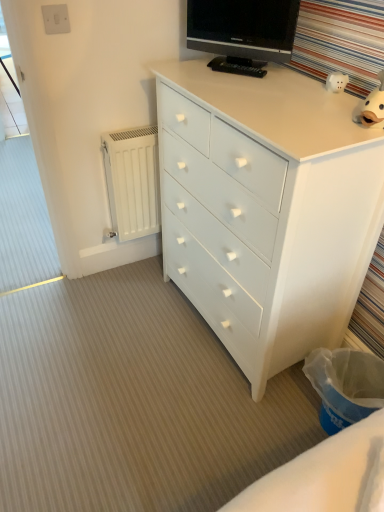
Question: Is white painted wood chest of drawers at center thinner than white plastic switch at upper left?

Choices:
 (A) yes
 (B) no

Answer: (B)

Question: Is white plastic switch at upper left a part of white painted wood chest of drawers at center?

Choices:
 (A) no
 (B) yes

Answer: (A)

Question: Is white painted wood chest of drawers at center oriented away from white plastic switch at upper left?

Choices:
 (A) no
 (B) yes

Answer: (A)

Question: From a real-world perspective, does white painted wood chest of drawers at center sit lower than white plastic switch at upper left?

Choices:
 (A) no
 (B) yes

Answer: (B)

Question: From the image's perspective, is white painted wood chest of drawers at center on top of white plastic switch at upper left?

Choices:
 (A) no
 (B) yes

Answer: (A)

Question: In terms of size, does black glossy tv at upper center appear bigger or smaller than transparent plastic screen door at upper left?

Choices:
 (A) big
 (B) small

Answer: (B)

Question: Is point (279, 12) positioned closer to the camera than point (6, 77)?

Choices:
 (A) farther
 (B) closer

Answer: (B)

Question: In terms of width, does black glossy tv at upper center look wider or thinner when compared to transparent plastic screen door at upper left?

Choices:
 (A) thin
 (B) wide

Answer: (A)

Question: Would you say black glossy tv at upper center is inside or outside transparent plastic screen door at upper left?

Choices:
 (A) outside
 (B) inside

Answer: (A)

Question: Considering the positions of point (254, 27) and point (334, 81), is point (254, 27) closer or farther from the camera than point (334, 81)?

Choices:
 (A) farther
 (B) closer

Answer: (A)

Question: Considering their positions, is black glossy tv at upper center located in front of or behind white glossy piggy bank at upper right?

Choices:
 (A) behind
 (B) front

Answer: (A)

Question: From the image's perspective, relative to white glossy piggy bank at upper right, is black glossy tv at upper center above or below?

Choices:
 (A) above
 (B) below

Answer: (A)

Question: Based on their sizes in the image, would you say black glossy tv at upper center is bigger or smaller than white glossy piggy bank at upper right?

Choices:
 (A) big
 (B) small

Answer: (A)

Question: From the image's perspective, is white plastic switch at upper left located above or below white glossy piggy bank at upper right?

Choices:
 (A) above
 (B) below

Answer: (A)

Question: Considering the positions of white plastic switch at upper left and white glossy piggy bank at upper right in the image, is white plastic switch at upper left taller or shorter than white glossy piggy bank at upper right?

Choices:
 (A) tall
 (B) short

Answer: (A)